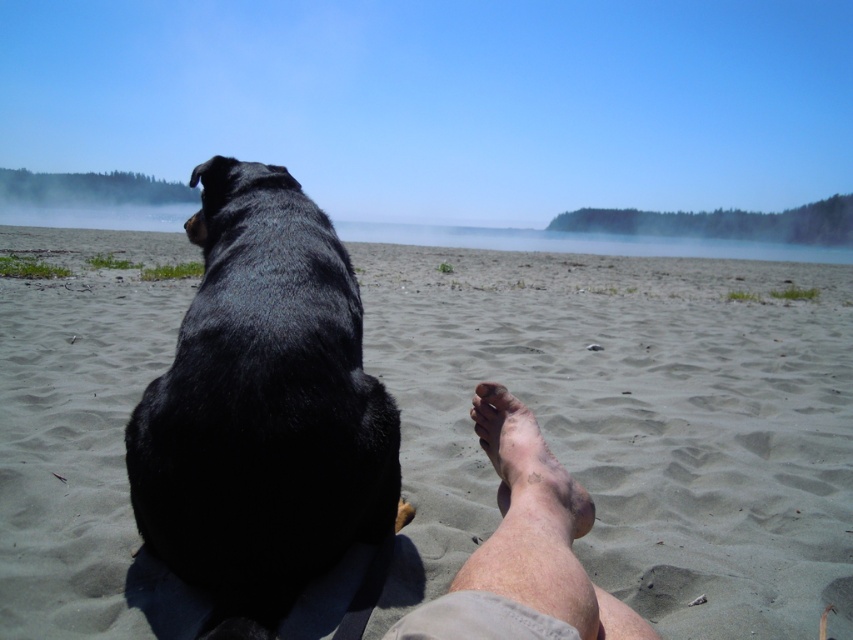
Is black fur dog at left above brown dirt foot at lower center?

Yes.

Where is `black fur dog at left`? Image resolution: width=853 pixels, height=640 pixels. black fur dog at left is located at coordinates (265, 413).

Does point (392, 637) come farther from viewer compared to point (505, 419)?

No.

Is point (491, 442) positioned after point (520, 419)?

Yes, it is.

Locate an element on the screen. skinny barefoot leg at lower center is located at coordinates (524, 548).

Is sandy at upper center to the left of black fur dog at left from the viewer's perspective?

Correct, you'll find sandy at upper center to the left of black fur dog at left.

This screenshot has height=640, width=853. Describe the element at coordinates (631, 422) in the screenshot. I see `sandy at upper center` at that location.

Where is `sandy at upper center`? Image resolution: width=853 pixels, height=640 pixels. sandy at upper center is located at coordinates (631, 422).